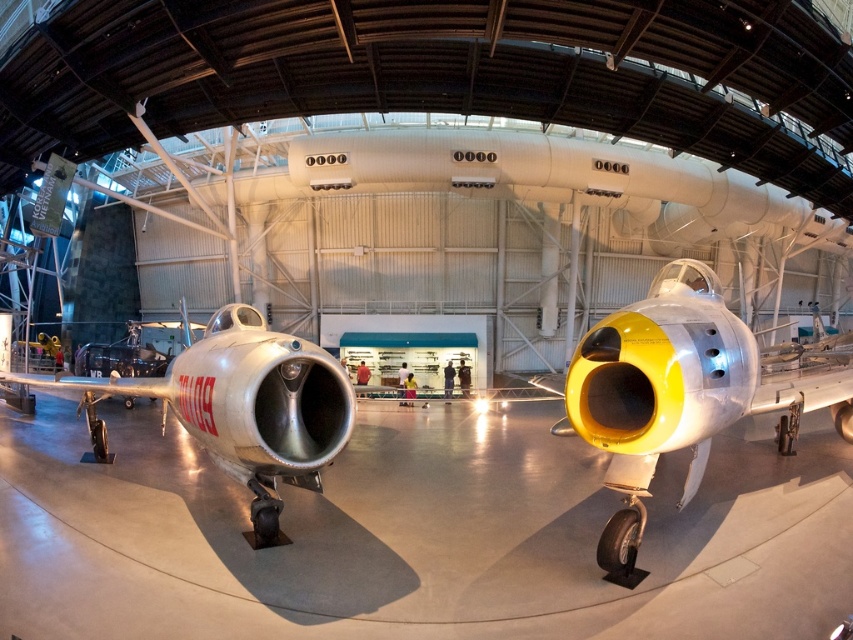
Question: Which point is farther to the camera?

Choices:
 (A) (154, 380)
 (B) (627, 468)

Answer: (A)

Question: Which point appears closest to the camera in this image?

Choices:
 (A) (287, 356)
 (B) (808, 400)

Answer: (A)

Question: From the image, what is the correct spatial relationship of yellow matte jet engine at center in relation to silver metallic airplane at center?

Choices:
 (A) below
 (B) above

Answer: (B)

Question: Which point is closer to the camera?

Choices:
 (A) yellow matte jet engine at center
 (B) silver metallic airplane at center

Answer: (A)

Question: Does yellow matte jet engine at center appear under silver metallic airplane at center?

Choices:
 (A) yes
 (B) no

Answer: (B)

Question: Is yellow matte jet engine at center bigger than silver metallic airplane at center?

Choices:
 (A) no
 (B) yes

Answer: (A)